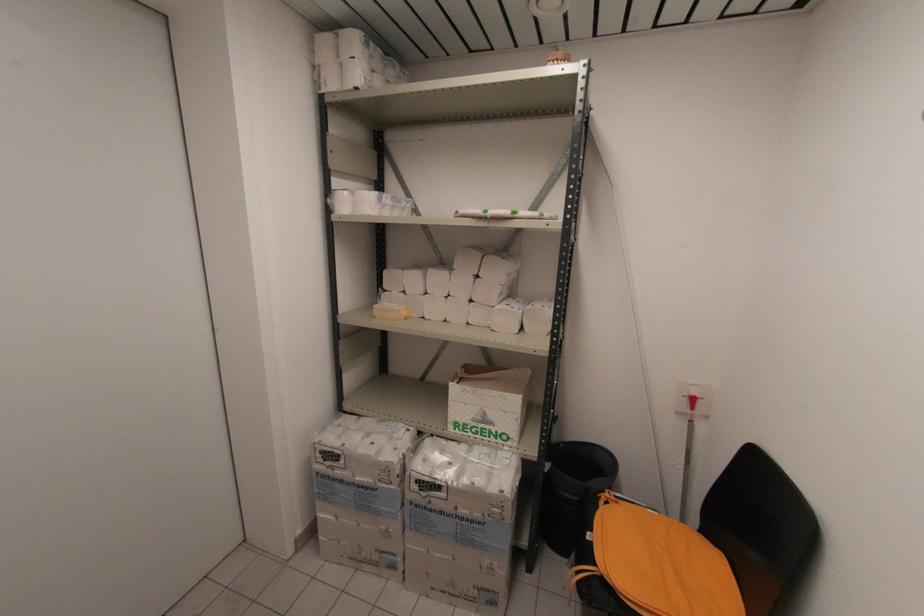
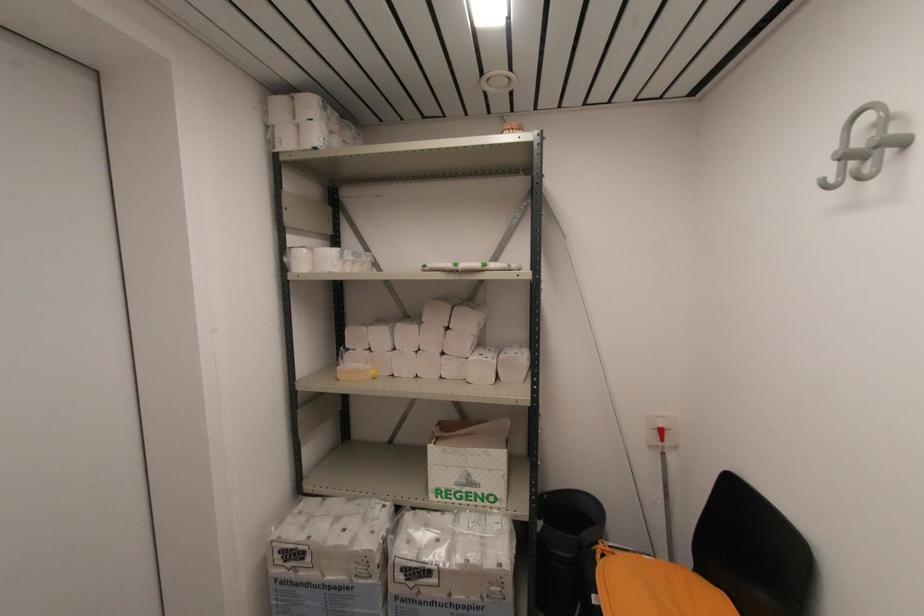
In the second image, find the point that corresponds to [495,452] in the first image.

(484, 517)